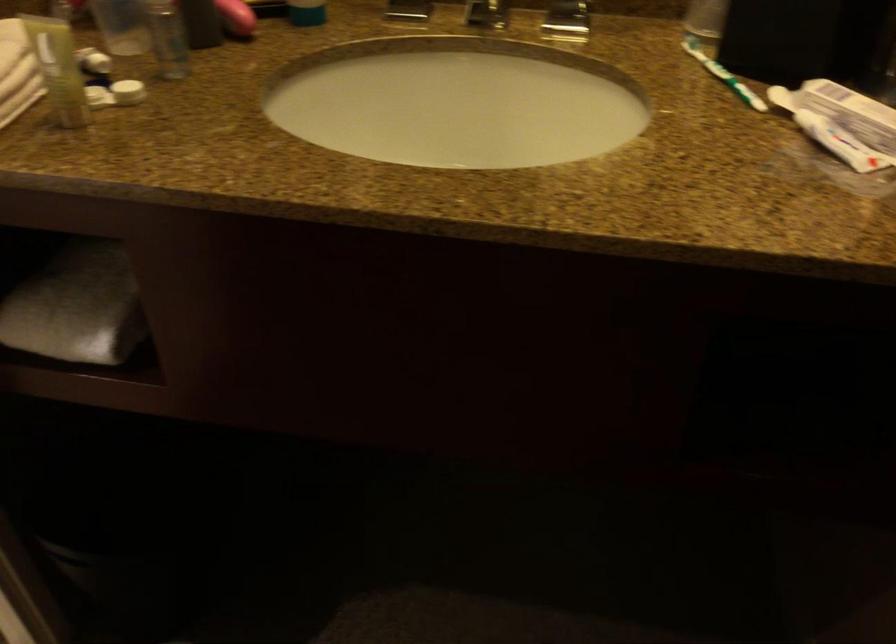
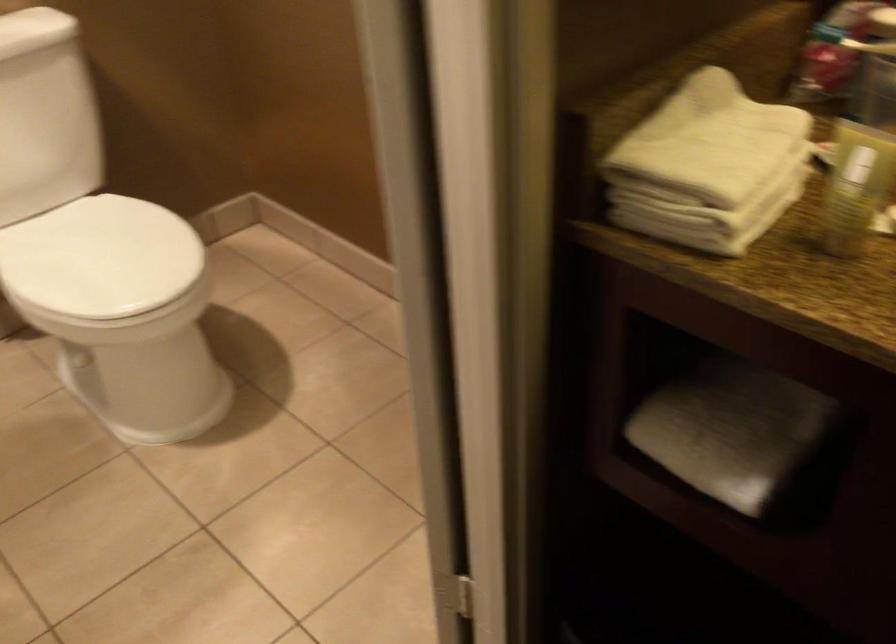
Question: How did the camera likely rotate?

Choices:
 (A) Left
 (B) Right
 (C) Up
 (D) Down

Answer: (A)